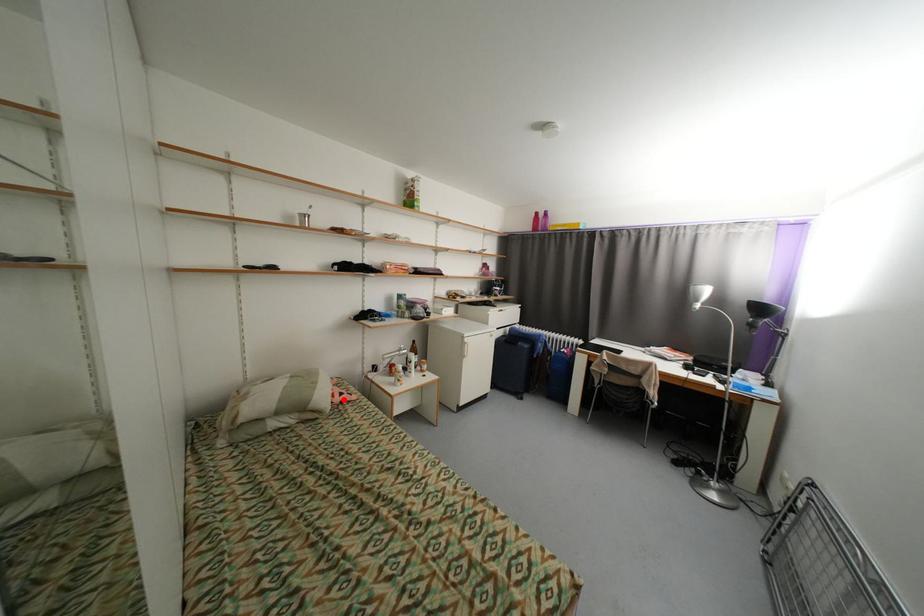
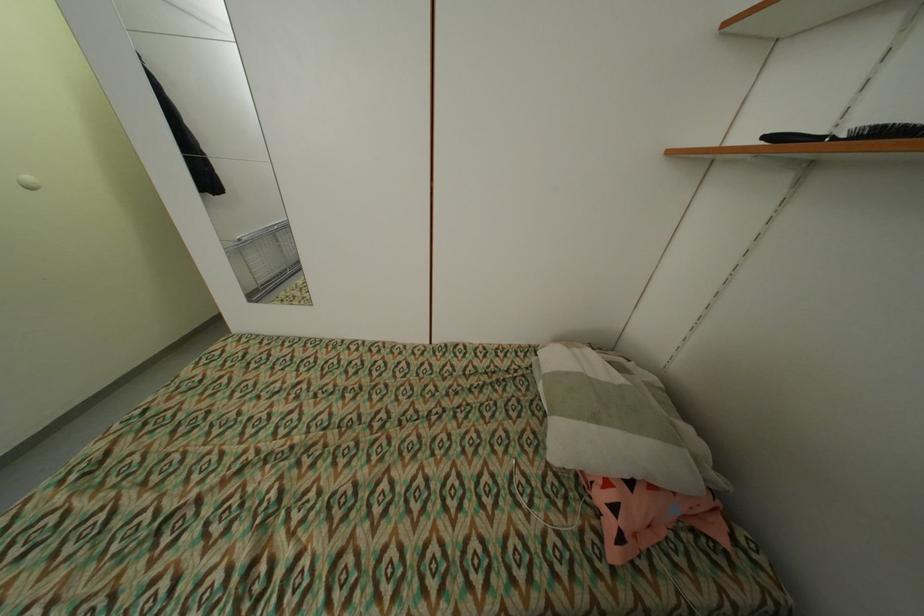
In the second image, find the point that corresponds to the highlighted location in the first image.

(606, 498)